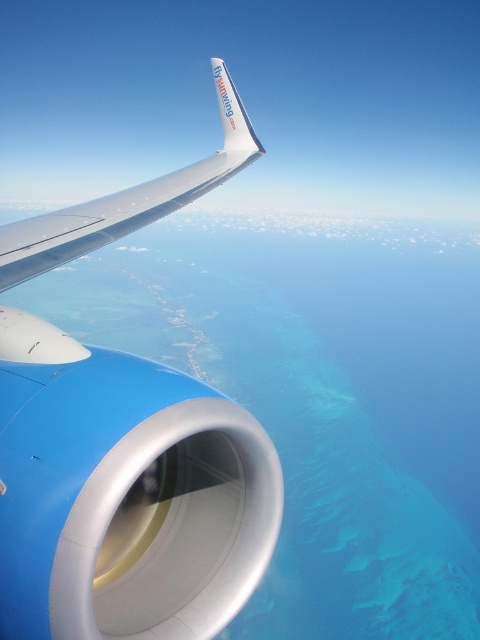
Question: Can you confirm if metallic silver wing at upper left is bigger than silver metallic wing at upper left?

Choices:
 (A) yes
 (B) no

Answer: (A)

Question: Which of the following is the closest to the observer?

Choices:
 (A) (33, 396)
 (B) (222, 172)

Answer: (A)

Question: Is metallic silver wing at upper left positioned before silver metallic wing at upper left?

Choices:
 (A) no
 (B) yes

Answer: (B)

Question: Can you confirm if metallic silver wing at upper left is positioned below silver metallic wing at upper left?

Choices:
 (A) no
 (B) yes

Answer: (A)